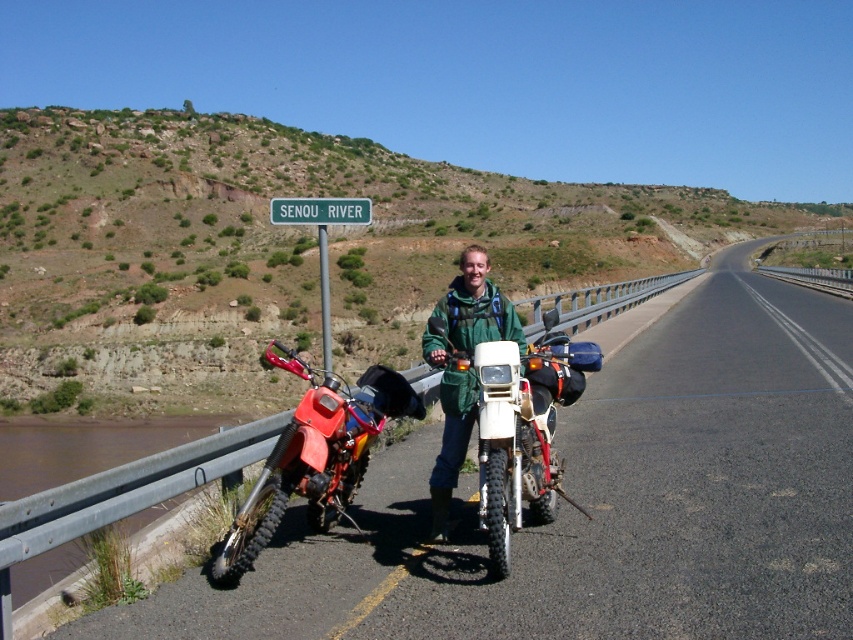
Between white matte motorcycle at center and green plastic sign at upper center, which one is positioned lower?

white matte motorcycle at center

The image size is (853, 640). Describe the element at coordinates (519, 422) in the screenshot. I see `white matte motorcycle at center` at that location.

What are the coordinates of `white matte motorcycle at center` in the screenshot? It's located at (519, 422).

The height and width of the screenshot is (640, 853). What do you see at coordinates (599, 504) in the screenshot?
I see `asphalt road at center` at bounding box center [599, 504].

Is asphalt road at center taller than orange matte dirt bike at left?

Yes, asphalt road at center is taller than orange matte dirt bike at left.

Is point (532, 557) positioned behind point (222, 573)?

Yes, it is behind point (222, 573).

Find the location of a particular element. This screenshot has width=853, height=640. asphalt road at center is located at coordinates (599, 504).

Can you confirm if green matte jacket at center is wider than green plastic sign at upper center?

No.

Can you confirm if green matte jacket at center is smaller than green plastic sign at upper center?

Yes, green matte jacket at center is smaller than green plastic sign at upper center.

Does point (466, 413) lie behind point (314, 200)?

No.

Where is `green matte jacket at center`? The width and height of the screenshot is (853, 640). green matte jacket at center is located at coordinates (x=460, y=369).